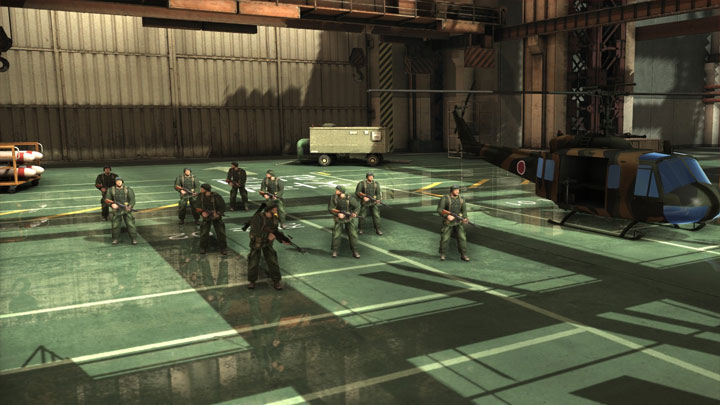
Locate an element on the screen. Image resolution: width=720 pixels, height=405 pixels. wall is located at coordinates (112, 90).